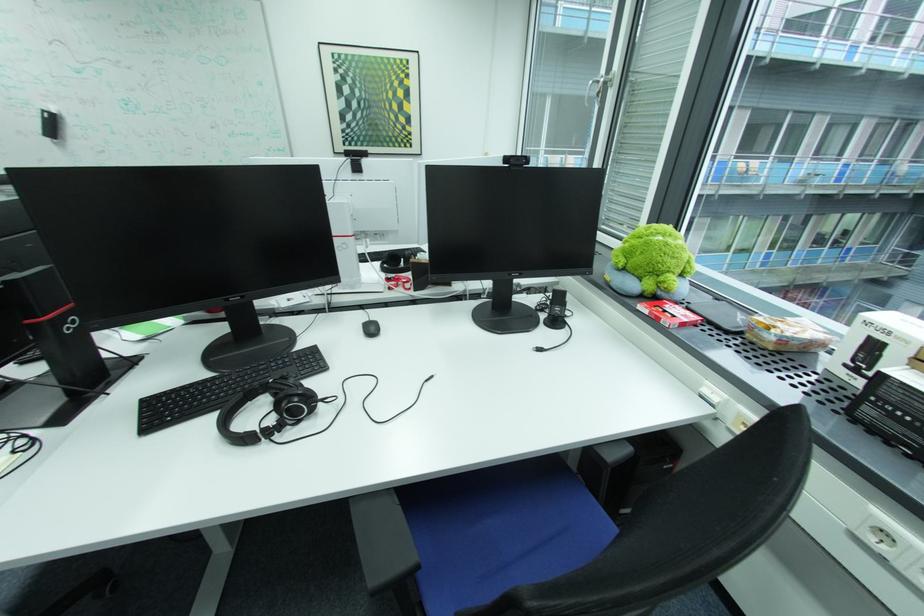
Find the location of a particular element. This screenshot has width=924, height=616. green stuffed toy is located at coordinates (650, 264).